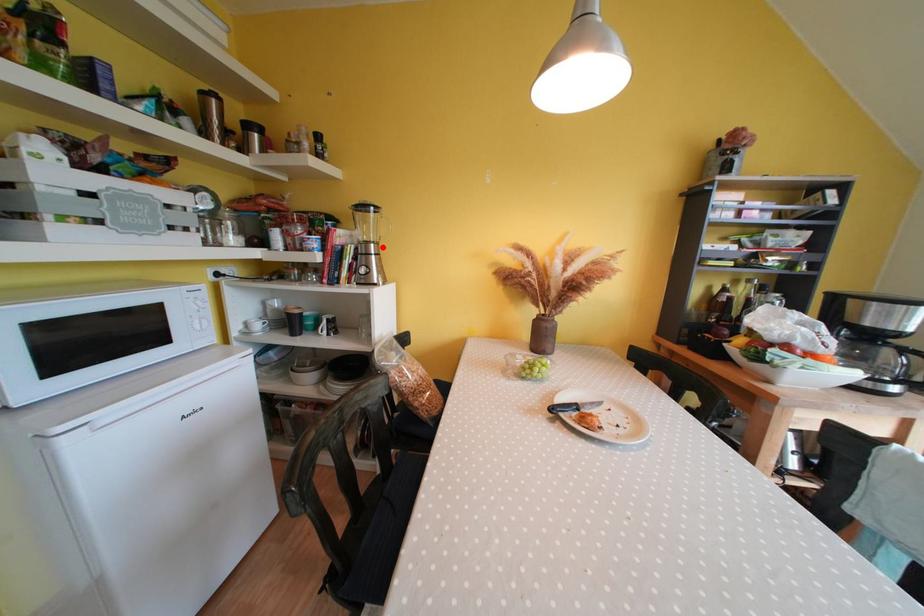
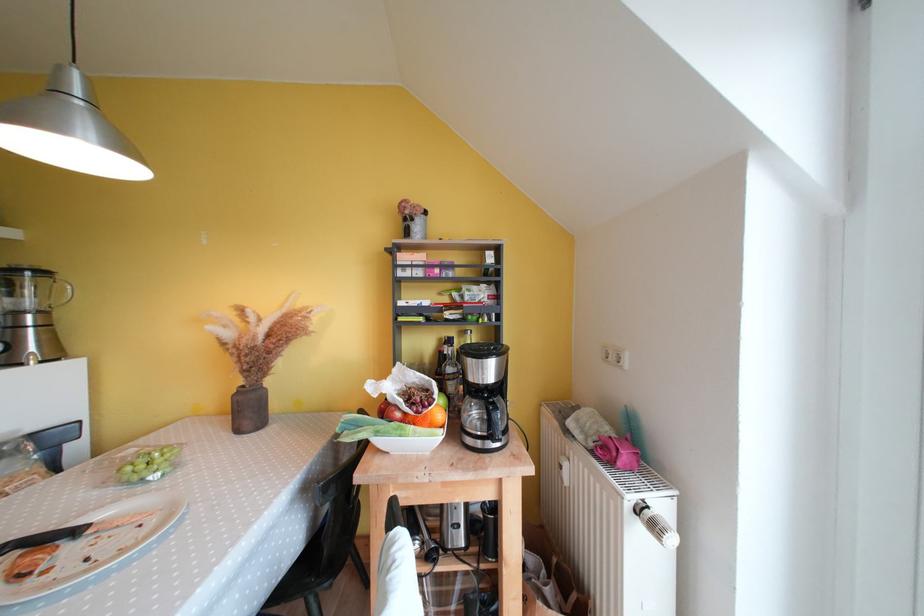
Locate, in the second image, the point that corresponds to the highlighted location in the first image.

(49, 315)